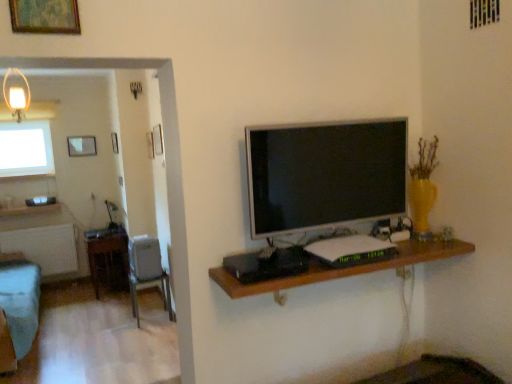
Measure the distance between point (98, 247) and camera.

4.79 meters.

This screenshot has width=512, height=384. Describe the element at coordinates (114, 143) in the screenshot. I see `wooden picture frame at upper left, which is the 2th picture frame in left-to-right order` at that location.

What do you see at coordinates (81, 146) in the screenshot? I see `matte glass picture frame at upper left, the 1th picture frame from the back` at bounding box center [81, 146].

This screenshot has height=384, width=512. What do you see at coordinates (45, 16) in the screenshot? I see `gold-framed artwork at upper left, the third picture frame when ordered from back to front` at bounding box center [45, 16].

Locate an element on the screen. matte glass lampshade at upper left is located at coordinates (17, 94).

Can you tell me how much wooden picture frame at upper left, which ranks as the 2th picture frame in back-to-front order, and teal fabric couch at left differ in facing direction?

The angle between the facing direction of wooden picture frame at upper left, which ranks as the 2th picture frame in back-to-front order, and the facing direction of teal fabric couch at left is 177 degrees.

Which of these two, wooden picture frame at upper left, which is the 2th picture frame in front-to-back order, or teal fabric couch at left, is thinner?

wooden picture frame at upper left, which is the 2th picture frame in front-to-back order.

Is wooden picture frame at upper left, which is the 2th picture frame in left-to-right order, taller or shorter than teal fabric couch at left?

In the image, wooden picture frame at upper left, which is the 2th picture frame in left-to-right order, appears to be shorter than teal fabric couch at left.

Is point (116, 144) farther from viewer compared to point (38, 294)?

Yes, it is behind point (38, 294).

In terms of width, does gold-framed artwork at upper left, the third picture frame when ordered from back to front, look wider or thinner when compared to wooden shelf at center?

In the image, gold-framed artwork at upper left, the third picture frame when ordered from back to front, appears to be more narrow than wooden shelf at center.

Looking at this image, is wooden shelf at center at the back of gold-framed artwork at upper left, positioned as the 1th picture frame in right-to-left order?

That's not correct — gold-framed artwork at upper left, positioned as the 1th picture frame in right-to-left order, is not looking away from wooden shelf at center.

This screenshot has width=512, height=384. In order to click on shelf below the gold-framed artwork at upper left, the third picture frame when ordered from back to front (from the image's perspective) in this screenshot , I will do `click(344, 269)`.

Does point (13, 30) appear closer or farther from the camera than point (293, 277)?

Point (13, 30) appears to be closer to the viewer than point (293, 277).

Is teal fabric couch at left oriented towards wooden shelf at center?

No, teal fabric couch at left is not facing towards wooden shelf at center.

You are a GUI agent. You are given a task and a screenshot of the screen. Output one action in this format:
    pyautogui.click(x=<x>, y=<y>)
    Task: Click on the furniture that appears behind the wooden shelf at center
    
    Given the screenshot: What is the action you would take?
    pyautogui.click(x=18, y=312)

From a real-world perspective, between teal fabric couch at left and wooden shelf at center, who is vertically lower?

In real-world perspective, teal fabric couch at left is lower.

Can you confirm if teal fabric couch at left is taller than wooden shelf at center?

Yes.

Does point (12, 26) lie in front of point (124, 235)?

Yes, it is in front of point (124, 235).

Which object is further away from the camera, gold-framed artwork at upper left, positioned as the 1th picture frame in right-to-left order, or wooden table at left?

wooden table at left is behind.

Is gold-framed artwork at upper left, the first picture frame viewed from the front, positioned far away from wooden table at left?

Yes, gold-framed artwork at upper left, the first picture frame viewed from the front, and wooden table at left are located far from each other.

In the image, is wooden table at left positioned in front of or behind wooden picture frame at upper left, which ranks as the 2th picture frame in back-to-front order?

wooden table at left is in front of wooden picture frame at upper left, which ranks as the 2th picture frame in back-to-front order.

From the picture: Is wooden table at left inside the boundaries of wooden picture frame at upper left, which ranks as the 2th picture frame in back-to-front order, or outside?

wooden table at left cannot be found inside wooden picture frame at upper left, which ranks as the 2th picture frame in back-to-front order.

Does wooden table at left have a greater height compared to wooden picture frame at upper left, which appears as the second picture frame when viewed from the right?

Correct, wooden table at left is much taller as wooden picture frame at upper left, which appears as the second picture frame when viewed from the right.

Is gold-framed artwork at upper left, the third picture frame when ordered from back to front, surrounded by silver metallic television at center?

Actually, gold-framed artwork at upper left, the third picture frame when ordered from back to front, is outside silver metallic television at center.

Could you tell me if silver metallic television at center is facing gold-framed artwork at upper left, positioned as the 1th picture frame in right-to-left order?

No, silver metallic television at center is not facing towards gold-framed artwork at upper left, positioned as the 1th picture frame in right-to-left order.

Is silver metallic television at center bigger or smaller than gold-framed artwork at upper left, positioned as the 1th picture frame in right-to-left order?

Clearly, silver metallic television at center is larger in size than gold-framed artwork at upper left, positioned as the 1th picture frame in right-to-left order.

Which is more to the right, silver metallic television at center or gold-framed artwork at upper left, the third picture frame positioned from the left?

Positioned to the right is silver metallic television at center.

Between wooden table at left and teal fabric couch at left, which one has more height?

teal fabric couch at left is taller.

Between wooden table at left and teal fabric couch at left, which one has larger size?

teal fabric couch at left is bigger.

Can you see wooden table at left touching teal fabric couch at left?

No, wooden table at left is not next to teal fabric couch at left.

Where is `furniture located on the left of wooden picture frame at upper left, which is the 2th picture frame in left-to-right order`? furniture located on the left of wooden picture frame at upper left, which is the 2th picture frame in left-to-right order is located at coordinates (18, 312).

Locate an element on the screen. The image size is (512, 384). the 3rd picture frame above the wooden shelf at center (from a real-world perspective) is located at coordinates (45, 16).

From the image, which object appears to be farther from wooden picture frame at upper left, which ranks as the 2th picture frame in back-to-front order, wooden shelf at center or matte glass lampshade at upper left?

wooden shelf at center.

When comparing their distances from wooden table at left, does white frosted glass window at upper left or teal fabric couch at left seem further?

white frosted glass window at upper left.

Looking at the image, which one is located further to white frosted glass window at upper left, silver metallic television at center or matte glass picture frame at upper left, the third picture frame positioned from the front?

silver metallic television at center is further to white frosted glass window at upper left.

When comparing their distances from gold-framed artwork at upper left, the third picture frame when ordered from back to front, does metallic gray chair at lower left or teal fabric couch at left seem further?

metallic gray chair at lower left lies further to gold-framed artwork at upper left, the third picture frame when ordered from back to front, than the other object.

Considering their positions, is metallic gray chair at lower left positioned closer to matte glass picture frame at upper left, which is the first picture frame from left to right, than gold-framed artwork at upper left, the first picture frame viewed from the front?

metallic gray chair at lower left.

When comparing their distances from wooden shelf at center, does white frosted glass window at upper left or silver metallic television at center seem closer?

Based on the image, silver metallic television at center appears to be nearer to wooden shelf at center.

Considering their positions, is matte glass picture frame at upper left, arranged as the third picture frame when viewed from the right, positioned closer to metallic gray chair at lower left than wooden picture frame at upper left, which is the 2th picture frame in front-to-back order?

wooden picture frame at upper left, which is the 2th picture frame in front-to-back order, is positioned closer to the anchor metallic gray chair at lower left.

Based on their spatial positions, is wooden picture frame at upper left, which appears as the second picture frame when viewed from the right, or matte glass lampshade at upper left closer to gold-framed artwork at upper left, the third picture frame positioned from the left?

matte glass lampshade at upper left is positioned closer to the anchor gold-framed artwork at upper left, the third picture frame positioned from the left.

You are a GUI agent. You are given a task and a screenshot of the screen. Output one action in this format:
    pyautogui.click(x=<x>, y=<y>)
    Task: Click on the table positioned between wooden shelf at center and wooden picture frame at upper left, which ranks as the 2th picture frame in back-to-front order, from near to far
    The width and height of the screenshot is (512, 384).
    Given the screenshot: What is the action you would take?
    pyautogui.click(x=108, y=259)

The width and height of the screenshot is (512, 384). In order to click on furniture between silver metallic television at center and matte glass picture frame at upper left, the 1th picture frame from the back, in the front-back direction in this screenshot , I will do `click(18, 312)`.

Where is `light fixture between silver metallic television at center and matte glass picture frame at upper left, which is the first picture frame from left to right, in the front-back direction`? light fixture between silver metallic television at center and matte glass picture frame at upper left, which is the first picture frame from left to right, in the front-back direction is located at coordinates (17, 94).

You are a GUI agent. You are given a task and a screenshot of the screen. Output one action in this format:
    pyautogui.click(x=<x>, y=<y>)
    Task: Click on the chair positioned between wooden shelf at center and white frosted glass window at upper left from near to far
    
    Given the screenshot: What is the action you would take?
    pyautogui.click(x=147, y=271)